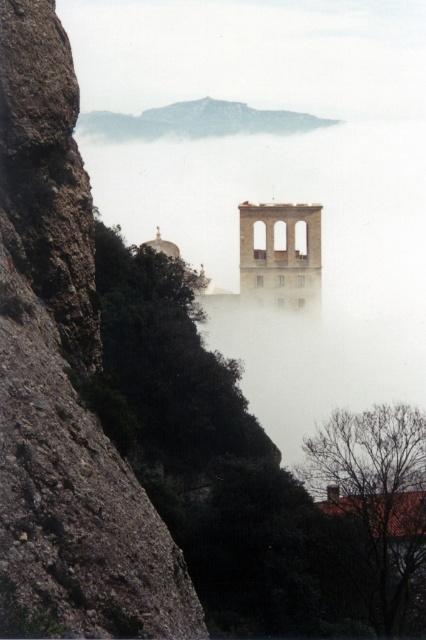
From the picture: You are a hiker who wants to take a photo of the smooth stone bell tower at center and the rocky gray mountain at upper center. Which object should you focus on first if you want to capture both in one frame without moving your camera?

You should focus on the smooth stone bell tower at center first because it is located below the rocky gray mountain at upper center, so adjusting the camera to include both would require ensuring the lower object is framed first.

You are an architect analyzing the spatial relationship between the smooth stone bell tower at center and the rocky gray mountain at upper center. Which of these two structures has a narrower width when viewed from your current perspective?

The smooth stone bell tower at center is thinner than the rocky gray mountain at upper center, so it has a narrower width when viewed from this perspective.